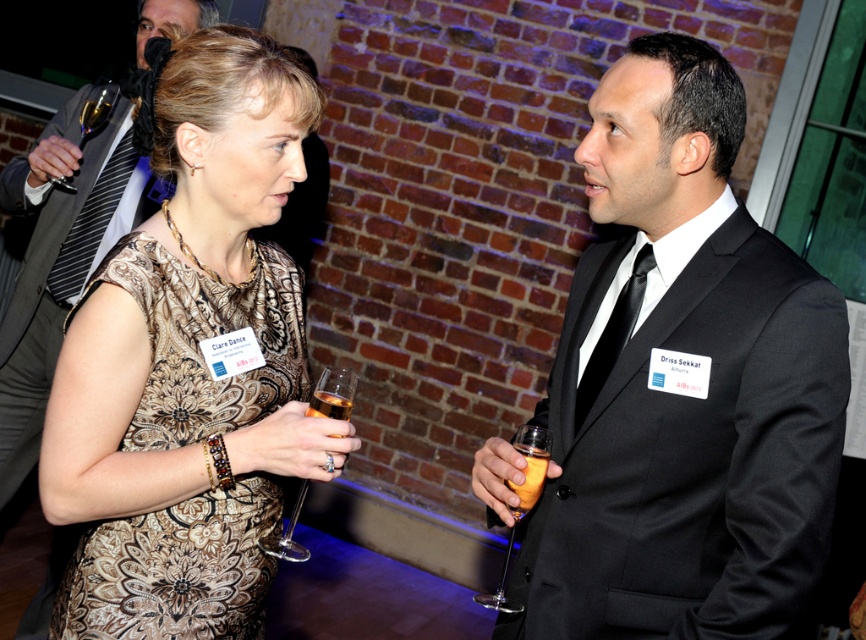
Can you confirm if translucent glass at right is bigger than clear glass wine glass at upper left?

Yes.

Which is more to the right, translucent glass at right or clear glass wine glass at upper left?

translucent glass at right

Image resolution: width=866 pixels, height=640 pixels. In order to click on translucent glass at right in this screenshot , I will do `click(521, 500)`.

Who is positioned more to the left, brown floral-patterned dress at center or translucent glass at right?

brown floral-patterned dress at center is more to the left.

Is brown floral-patterned dress at center taller than translucent glass at right?

Result: Yes.

Find the location of a particular element. The width and height of the screenshot is (866, 640). brown floral-patterned dress at center is located at coordinates (175, 568).

This screenshot has height=640, width=866. In order to click on brown floral-patterned dress at center in this screenshot , I will do `click(175, 568)`.

Is translucent glass at right further to camera compared to amber liquid glass at center?

That is True.

Who is taller, translucent glass at right or amber liquid glass at center?

With more height is translucent glass at right.

Who is more forward, (535, 444) or (326, 394)?

Point (326, 394) is in front.

The width and height of the screenshot is (866, 640). Find the location of `translucent glass at right`. translucent glass at right is located at coordinates (521, 500).